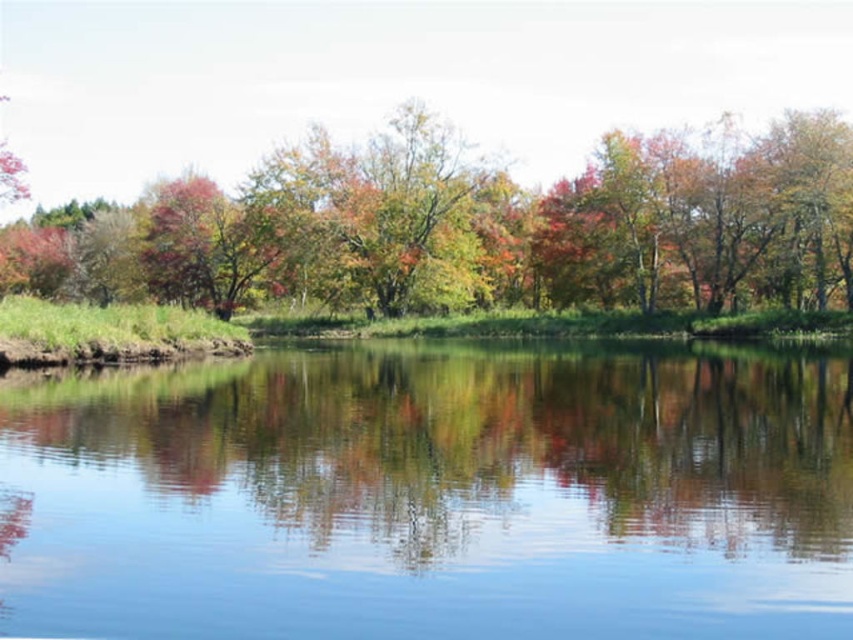
Measure the distance between clear water at center and multicolored foliage at center.

A distance of 42.67 meters exists between clear water at center and multicolored foliage at center.

Does clear water at center have a smaller size compared to multicolored foliage at center?

Correct, clear water at center occupies less space than multicolored foliage at center.

At what (x,y) coordinates should I click in order to perform the action: click on clear water at center. Please return your answer as a coordinate pair (x, y). The height and width of the screenshot is (640, 853). Looking at the image, I should click on (434, 496).